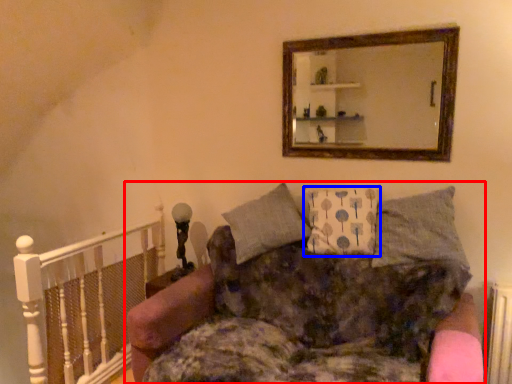
Question: Which object is closer to the camera taking this photo, studio couch (highlighted by a red box) or pillow (highlighted by a blue box)?

Choices:
 (A) studio couch
 (B) pillow

Answer: (A)